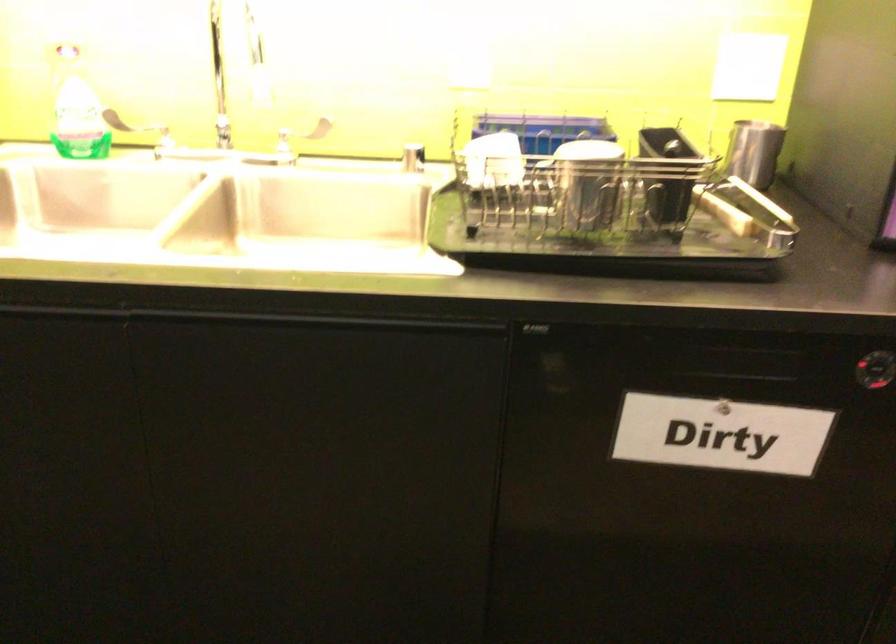
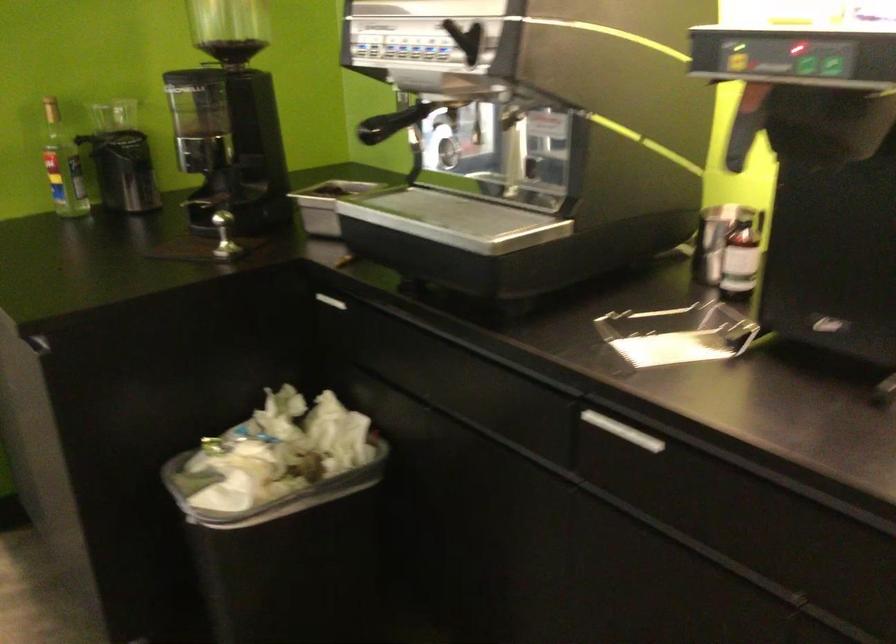
Question: The camera is either moving clockwise (left) or counter-clockwise (right) around the object. The first image is from the beginning of the video and the second image is from the end. Is the camera moving left or right when shooting the video?

Choices:
 (A) Left
 (B) Right

Answer: (B)